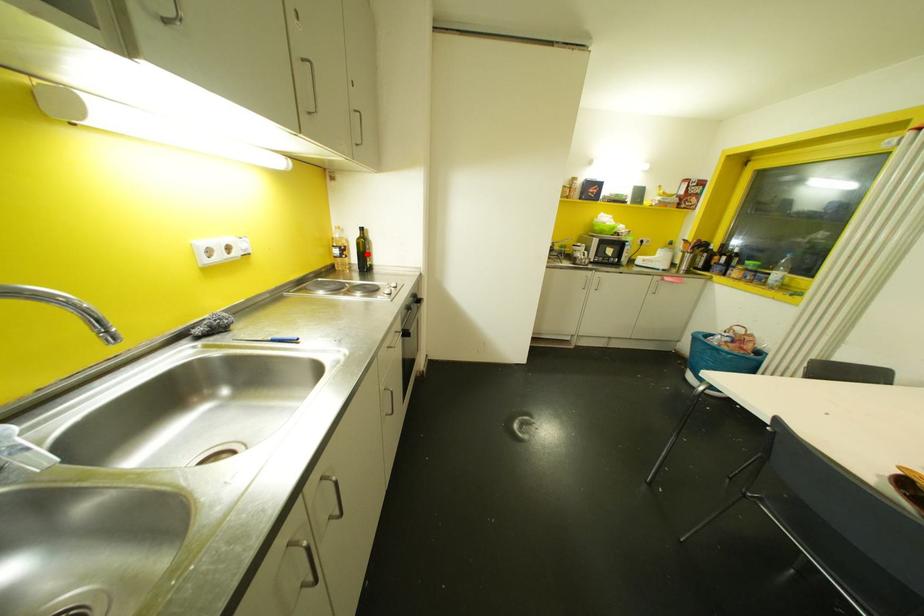
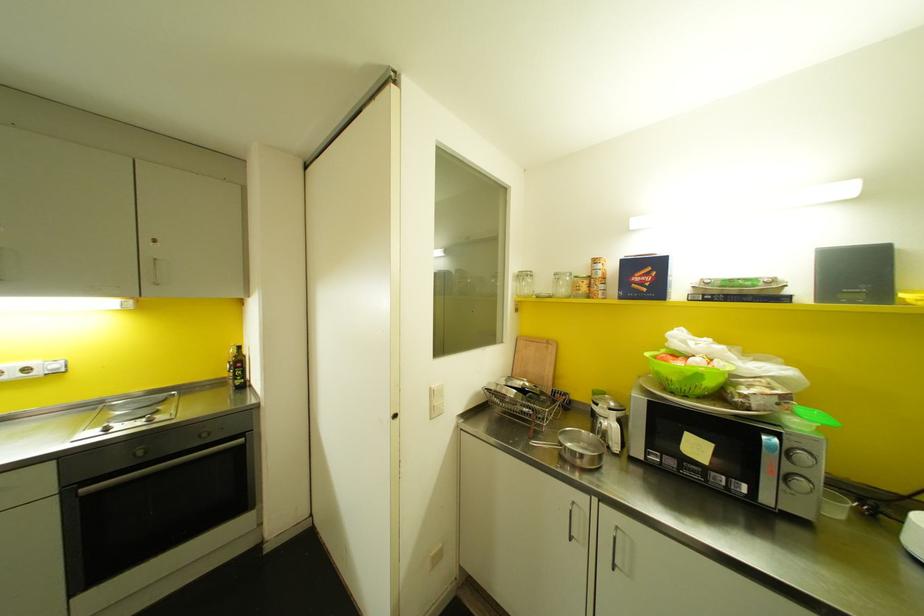
Locate, in the second image, the point that corresponds to the highlighted location in the first image.

(237, 371)